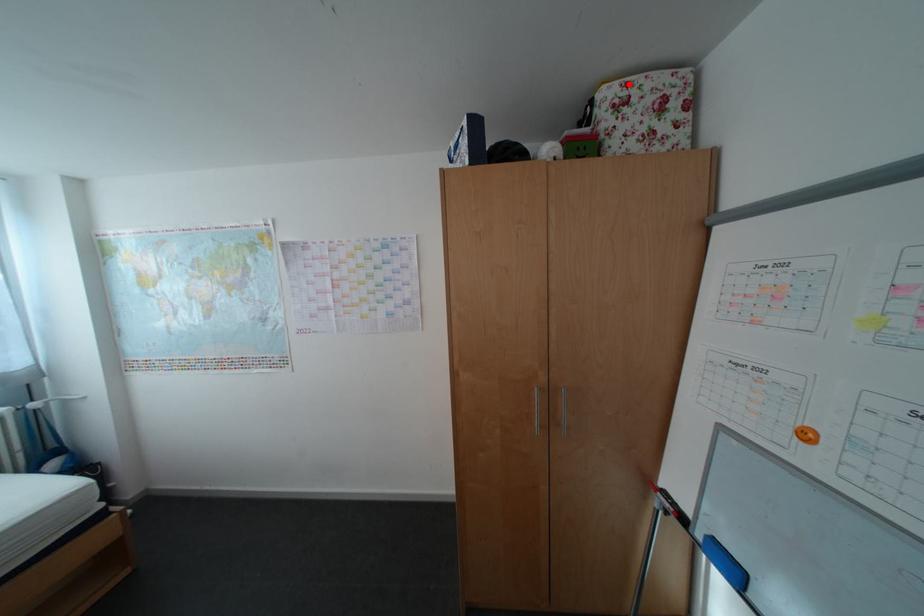
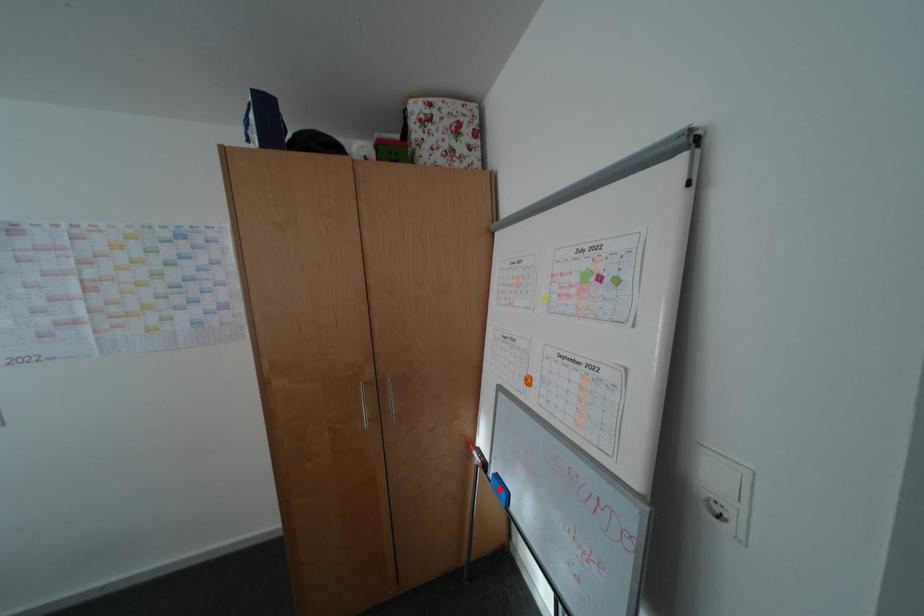
I am providing you with two images of the same scene from different viewpoints. A red point is marked on the first image and another point is marked on the second image. Does the point marked in image1 correspond to the same location as the one in image2?

No